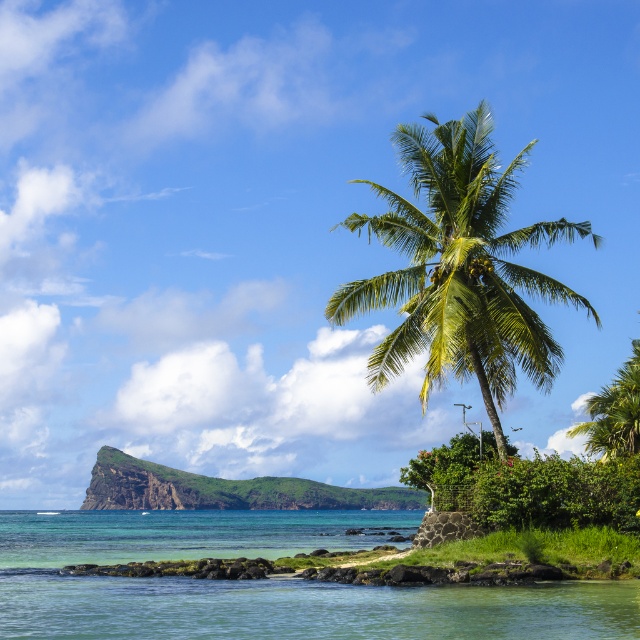
Question: Which point is farther to the camera?

Choices:
 (A) green rocky island at center
 (B) green leafy coconut tree at center

Answer: (A)

Question: Estimate the real-world distances between objects in this image. Which object is closer to the green rocky island at center?

Choices:
 (A) clear blue water at lower left
 (B) green leafy coconut tree at center

Answer: (A)

Question: Can you confirm if clear blue water at lower left is positioned to the left of green leafy coconut tree at center?

Choices:
 (A) yes
 (B) no

Answer: (A)

Question: Is the position of clear blue water at lower left less distant than that of green leafy coconut tree at center?

Choices:
 (A) no
 (B) yes

Answer: (B)

Question: Which of the following is the closest to the observer?

Choices:
 (A) (40, 561)
 (B) (392, 208)

Answer: (B)

Question: Does clear blue water at lower left appear on the left side of green rocky island at center?

Choices:
 (A) yes
 (B) no

Answer: (B)